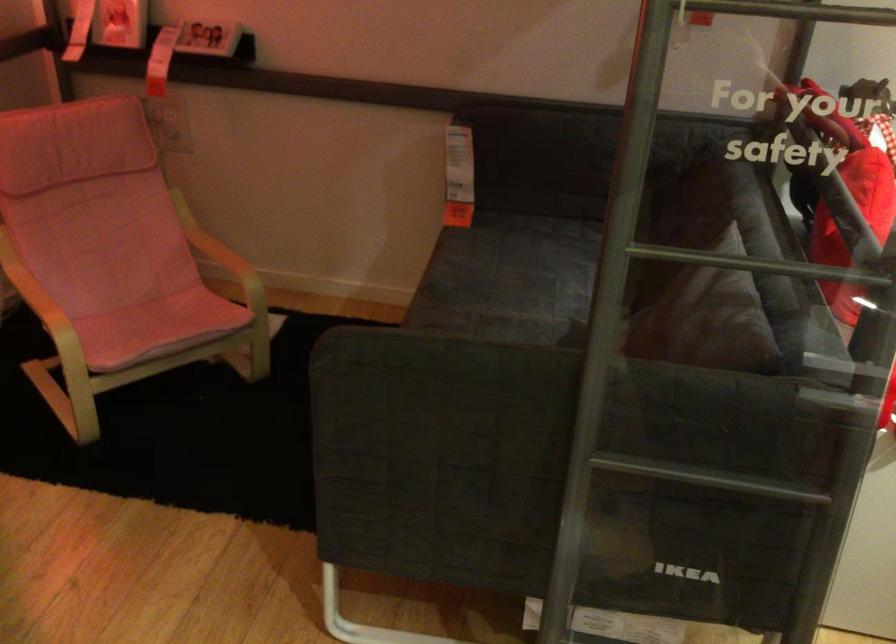
Find where to sit the grey sofa sitting surface. Please return your answer as a coordinate pair (x, y).

(523, 276)